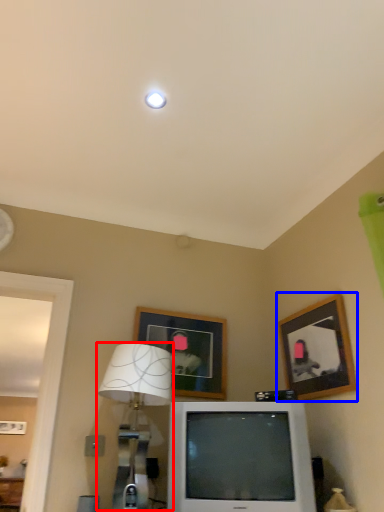
Question: Among these objects, which one is farthest to the camera, table lamp (highlighted by a red box) or picture frame (highlighted by a blue box)?

Choices:
 (A) table lamp
 (B) picture frame

Answer: (B)